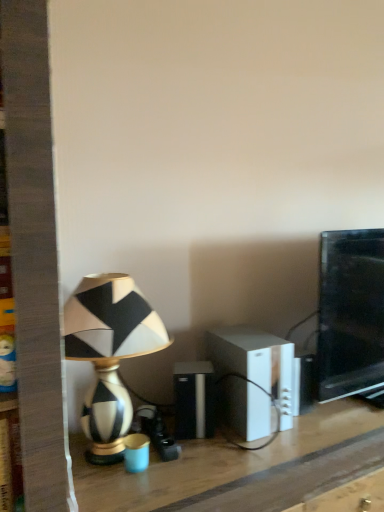
Question: Is black and white ceramic lamp at left wider or thinner than wooden table at center?

Choices:
 (A) thin
 (B) wide

Answer: (A)

Question: Is black and white ceramic lamp at left spatially inside wooden table at center, or outside of it?

Choices:
 (A) inside
 (B) outside

Answer: (B)

Question: Which of these objects is positioned farthest from the black glossy monitor at right?

Choices:
 (A) white plastic speaker at center, which is the 2th speaker from left to right
 (B) black and white ceramic lamp at left
 (C) black plastic speaker at center, which is the first speaker from left to right
 (D) wooden table at center

Answer: (B)

Question: Which is farther from the wooden table at center?

Choices:
 (A) white plastic speaker at center, which is the 2th speaker from left to right
 (B) black and white ceramic lamp at left
 (C) black glossy monitor at right
 (D) black plastic speaker at center, which is the first speaker from left to right

Answer: (C)